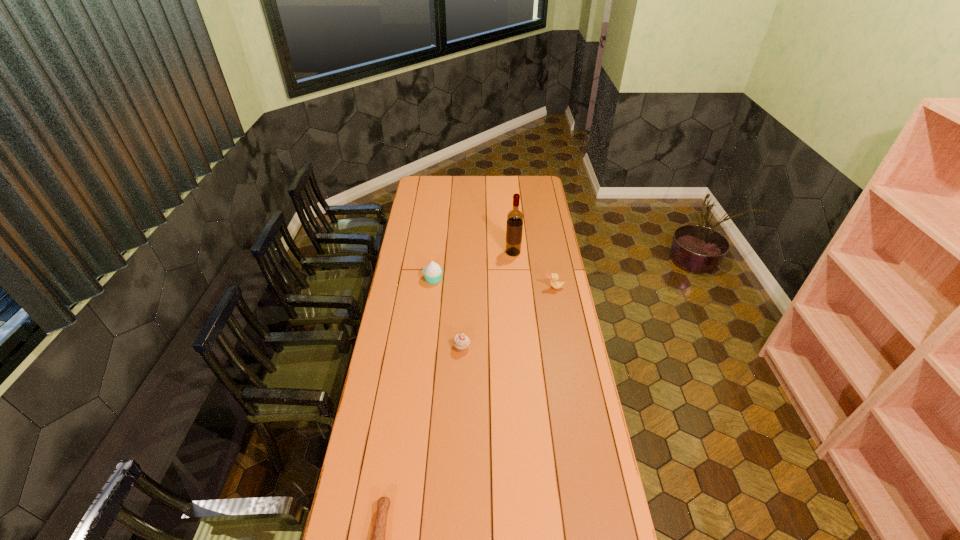
The height and width of the screenshot is (540, 960). Identify the location of vacant space located on the front of the right cupcake. (461, 381).

Identify the location of object that is at the left edge. The height and width of the screenshot is (540, 960). (433, 272).

Where is `object situated at the right edge`? This screenshot has width=960, height=540. object situated at the right edge is located at coordinates (554, 277).

At what (x,y) coordinates should I click in order to perform the action: click on vacant space at the far edge of the desktop. Please return your answer as a coordinate pair (x, y). This screenshot has width=960, height=540. Looking at the image, I should click on (470, 191).

Locate an element on the screen. The width and height of the screenshot is (960, 540). vacant point at the left edge is located at coordinates (410, 225).

Where is `vacant space at the right edge of the desktop`? vacant space at the right edge of the desktop is located at coordinates (545, 213).

Identify the location of empty space that is in between the third object from right to left and the left cupcake. Image resolution: width=960 pixels, height=540 pixels. (447, 313).

In order to click on vacant region between the left cupcake and the rightmost object in this screenshot , I will do `click(493, 283)`.

This screenshot has width=960, height=540. Identify the location of free point between the right cupcake and the tallest object. (488, 300).

This screenshot has width=960, height=540. Identify the location of blank region between the farther cupcake and the rightmost object. 493,283.